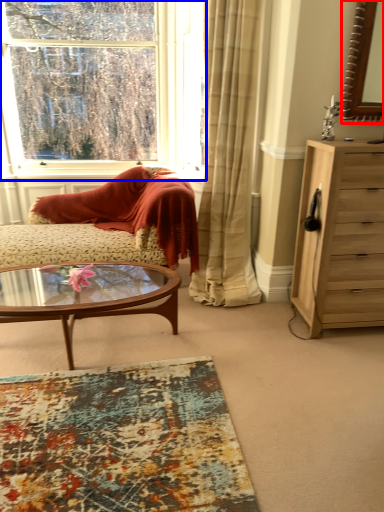
Question: Which object is closer to the camera taking this photo, mirror (highlighted by a red box) or window (highlighted by a blue box)?

Choices:
 (A) mirror
 (B) window

Answer: (A)